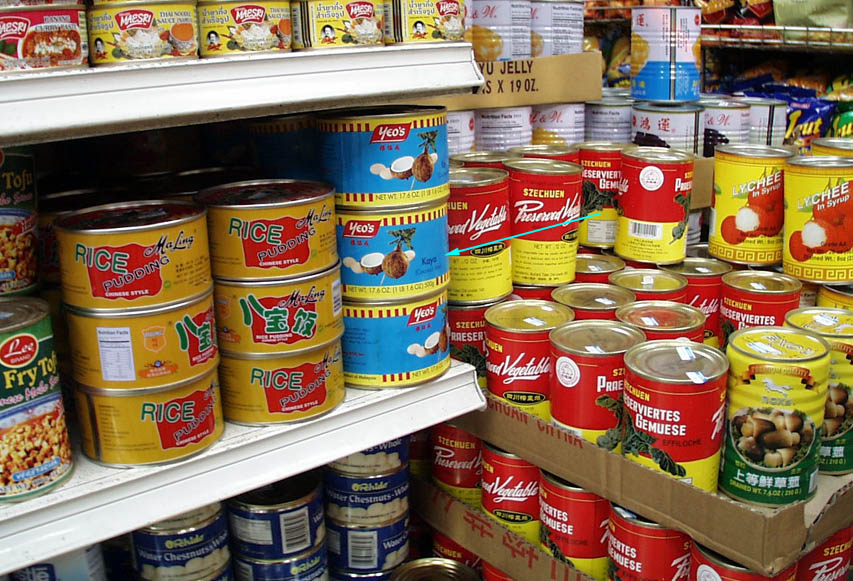
This screenshot has height=581, width=853. Identify the location of box. (723, 534), (550, 579).